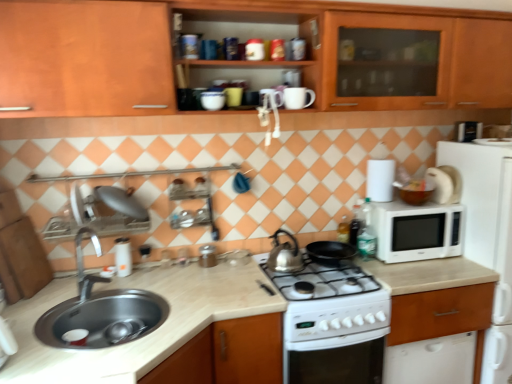
The height and width of the screenshot is (384, 512). In order to click on free spot to the right of white glossy water filter at left, which is the 1th appliance from front to back in this screenshot , I will do click(x=155, y=272).